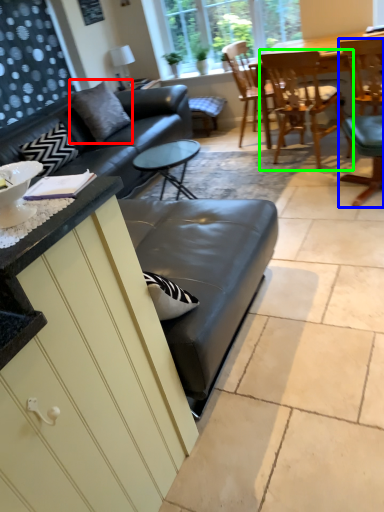
Question: Which object is the closest to the pillow (highlighted by a red box)? Choose among these: chair (highlighted by a blue box) or chair (highlighted by a green box).

Choices:
 (A) chair
 (B) chair

Answer: (B)